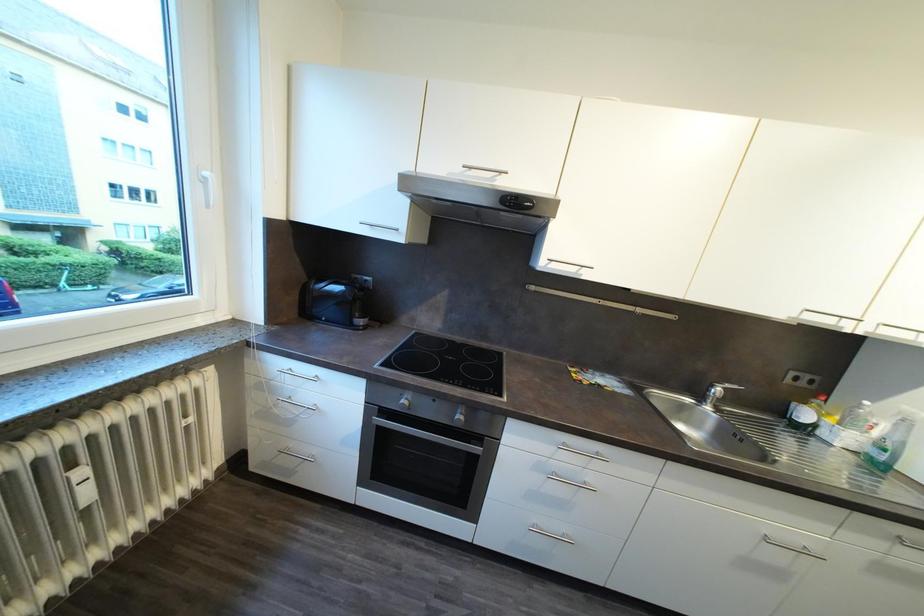
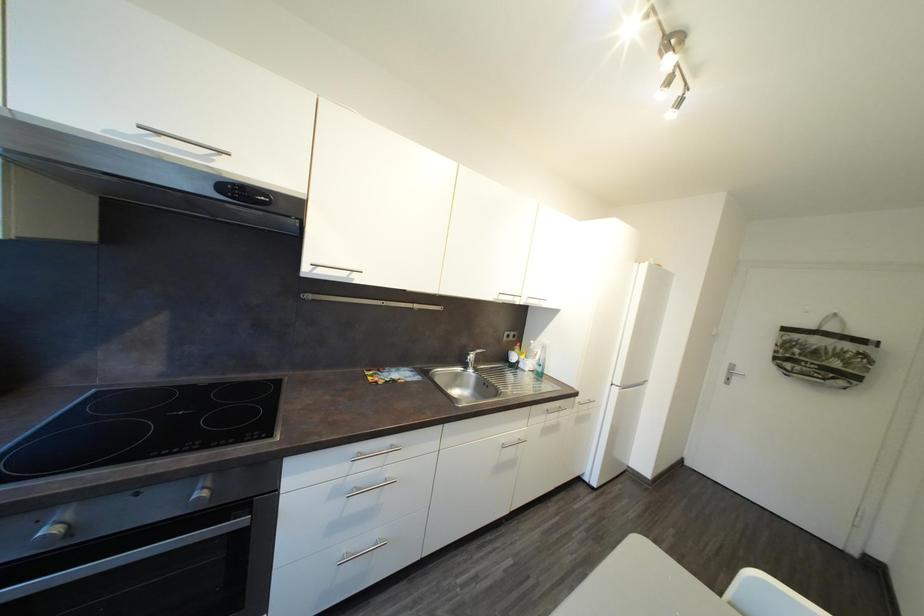
Question: The camera is either moving clockwise (left) or counter-clockwise (right) around the object. The first image is from the beginning of the video and the second image is from the end. Is the camera moving left or right when shooting the video?

Choices:
 (A) Left
 (B) Right

Answer: (A)